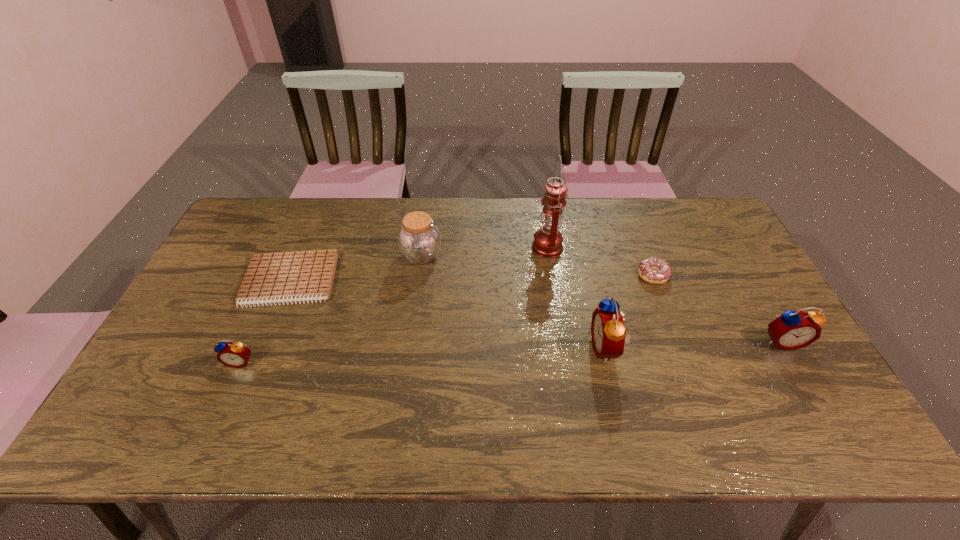
Locate an element on the screen. The image size is (960, 540). the third shortest object is located at coordinates coord(232,354).

Locate an element on the screen. This screenshot has height=540, width=960. the leftmost alarm clock is located at coordinates (232, 354).

Image resolution: width=960 pixels, height=540 pixels. Identify the location of the second alarm clock from right to left. (608, 331).

Locate an element on the screen. This screenshot has width=960, height=540. the rightmost alarm clock is located at coordinates (791, 330).

This screenshot has width=960, height=540. In order to click on the second shortest alarm clock in this screenshot , I will do `click(791, 330)`.

This screenshot has height=540, width=960. In order to click on the tallest object in this screenshot , I will do `click(548, 241)`.

I want to click on the fourth object from right to left, so click(548, 241).

Identify the location of notebook. The height and width of the screenshot is (540, 960). (279, 277).

In order to click on the second shortest object in this screenshot , I will do tap(653, 270).

I want to click on the sixth object from left to right, so click(x=653, y=270).